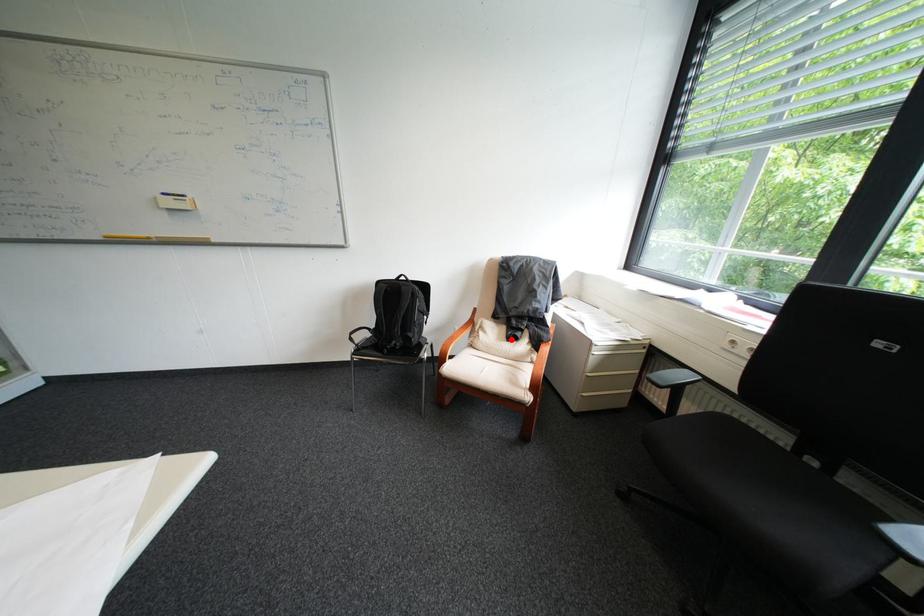
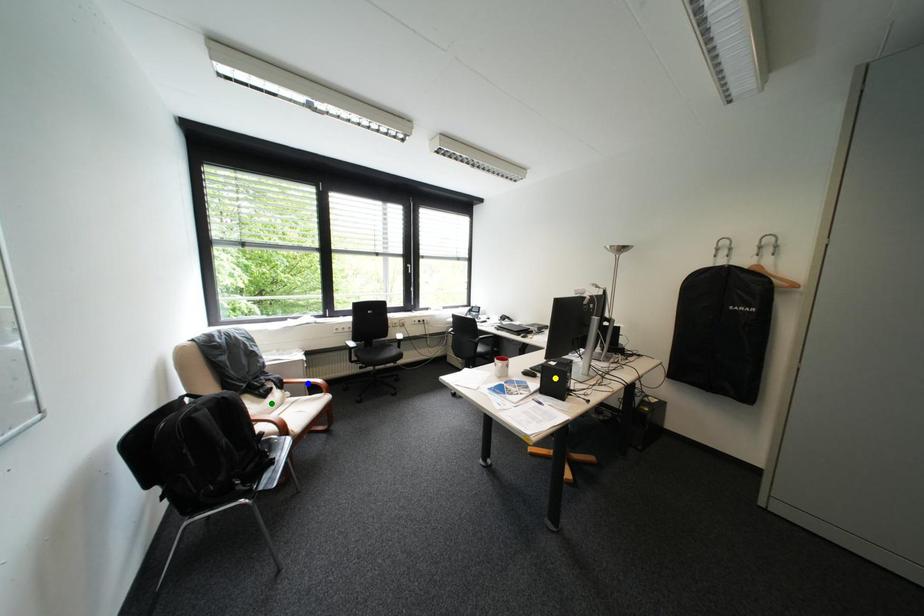
Question: I am providing you with two images of the same scene from different viewpoints. A red point is marked on the first image. You are given multiple points on the second image. Which point in image 2 represents the same 3d spot as the red point in image 1?

Choices:
 (A) green point
 (B) blue point
 (C) yellow point

Answer: (A)